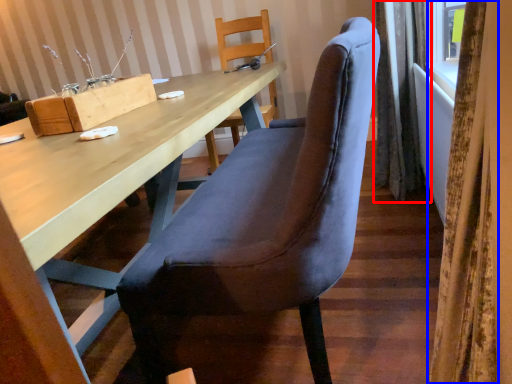
Question: Which object appears closest to the camera in this image, curtain (highlighted by a red box) or curtain (highlighted by a blue box)?

Choices:
 (A) curtain
 (B) curtain

Answer: (B)